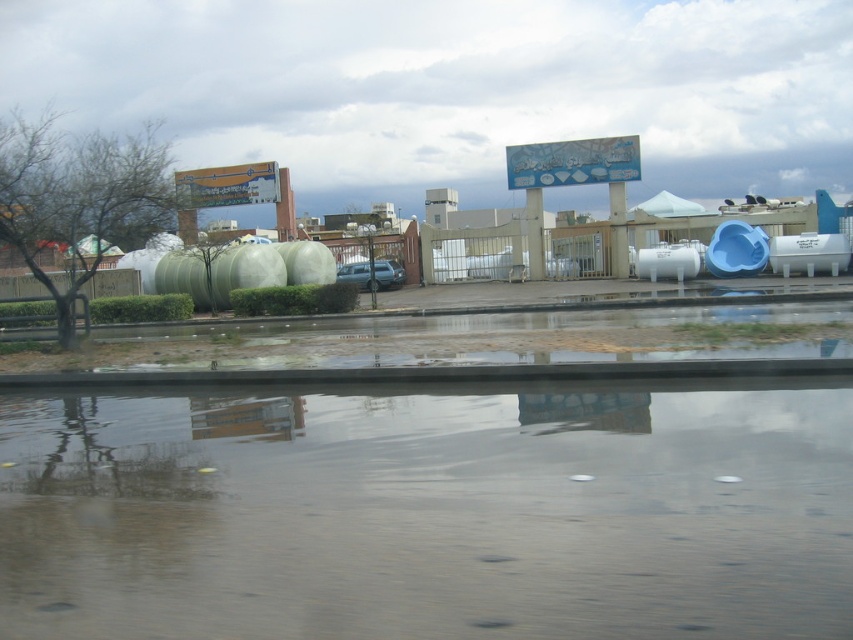
Question: Does transparent water at lower center appear on the right side of blue plastic slide at right?

Choices:
 (A) no
 (B) yes

Answer: (A)

Question: Which object appears closest to the camera in this image?

Choices:
 (A) transparent water at lower center
 (B) blue plastic slide at right

Answer: (A)

Question: Can you confirm if transparent water at lower center is wider than blue plastic slide at right?

Choices:
 (A) yes
 (B) no

Answer: (B)

Question: Can you confirm if transparent water at lower center is thinner than blue plastic slide at right?

Choices:
 (A) no
 (B) yes

Answer: (B)

Question: Which object is farther from the camera taking this photo?

Choices:
 (A) transparent water at lower center
 (B) blue plastic slide at right

Answer: (B)